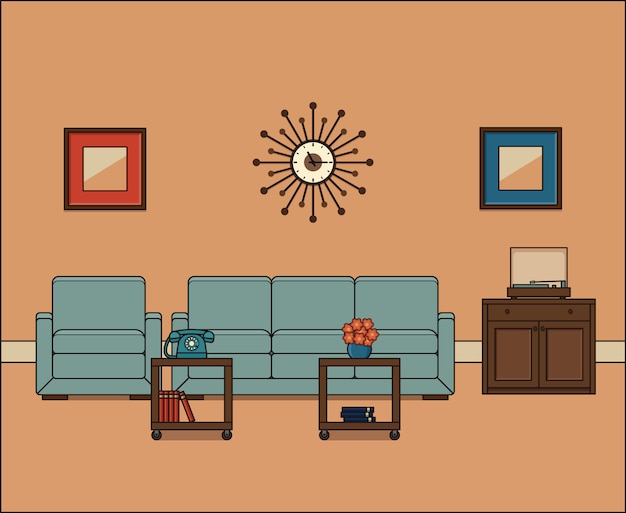
The image size is (626, 513). Find the location of `light orange background wall`. light orange background wall is located at coordinates [x=69, y=251], [x=253, y=251], [x=220, y=80], [x=91, y=58], [x=394, y=47], [x=424, y=240], [x=562, y=51], [x=605, y=205], [x=471, y=282].